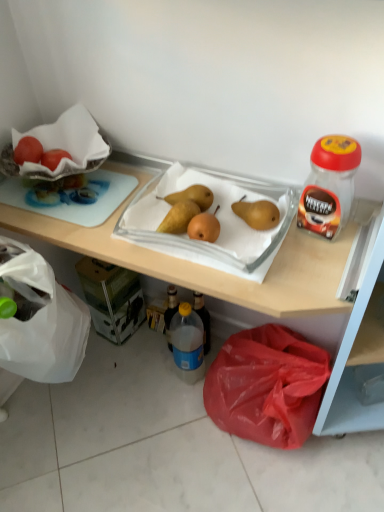
The height and width of the screenshot is (512, 384). Identify the location of spots to the right of matte white grapefruit at upper left. (103, 179).